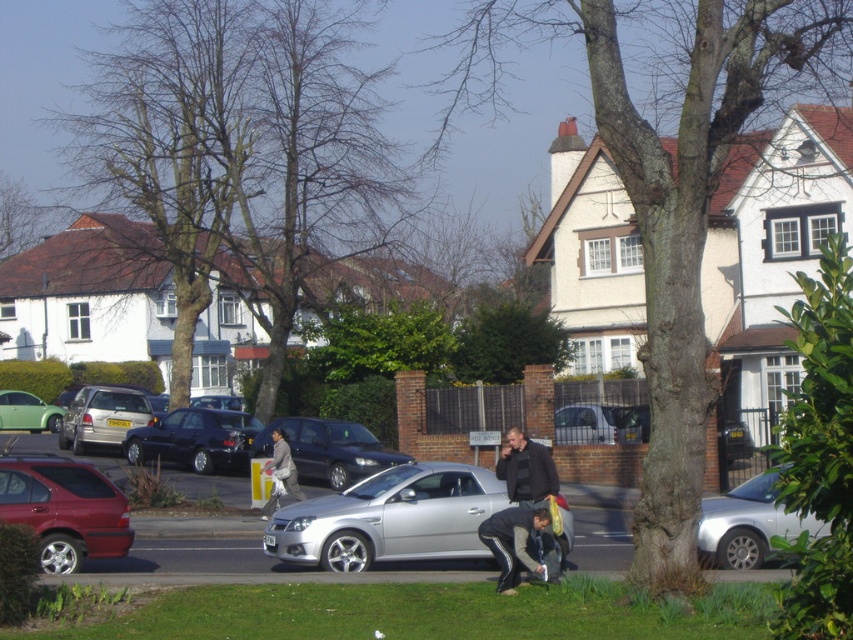
Question: Which is farther from the shiny dark blue sedan at center-left?

Choices:
 (A) silver metallic van at center
 (B) satin black car at center
 (C) silver metallic hatchback at center-left
 (D) silver metallic car at lower right

Answer: (D)

Question: Does silver metallic car at lower right lie behind light brown leather jacket at center?

Choices:
 (A) yes
 (B) no

Answer: (B)

Question: Which point is farther to the camera?

Choices:
 (A) silver metallic hatchback at center-left
 (B) satin black car at center

Answer: (A)

Question: Is satin black car at center to the left of silver metallic van at center from the viewer's perspective?

Choices:
 (A) no
 (B) yes

Answer: (B)

Question: Which point is closer to the camera?

Choices:
 (A) silver metallic car at lower right
 (B) silver metallic hatchback at center-left
 (C) metallic red car at left
 (D) light brown leather jacket at center

Answer: (A)

Question: Is dark brown leather jacket at center thinner than light brown leather jacket at center?

Choices:
 (A) no
 (B) yes

Answer: (B)